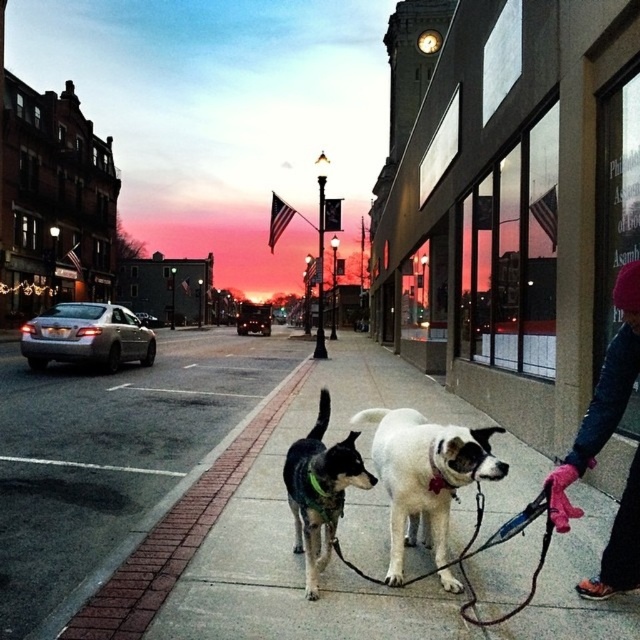
Who is higher up, concrete sidewalk at center or black and white fur at center?

black and white fur at center is higher up.

Is point (189, 602) more distant than point (326, 486)?

That is True.

Image resolution: width=640 pixels, height=640 pixels. Identify the location of concrete sidewalk at center. (348, 568).

Who is taller, white fur dog at center or black and white fur at center?

black and white fur at center

Can you confirm if white fur dog at center is positioned to the right of black and white fur at center?

Correct, you'll find white fur dog at center to the right of black and white fur at center.

This screenshot has width=640, height=640. In order to click on white fur dog at center in this screenshot , I will do `click(426, 477)`.

Does concrete sidewalk at center have a greater height compared to white fur dog at center?

No.

Does concrete sidewalk at center have a lesser width compared to white fur dog at center?

No, concrete sidewalk at center is not thinner than white fur dog at center.

Is point (369, 595) positioned after point (445, 444)?

That is True.

Locate an element on the screen. concrete sidewalk at center is located at coordinates (348, 568).